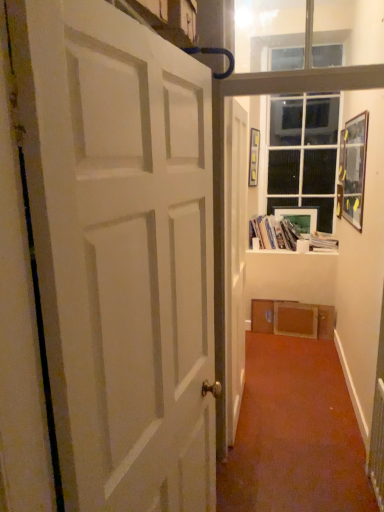
Question: Is the position of white plastic radiator at lower right more distant than that of matte plastic picture frame at upper center, the 2th picture frame positioned from the front?

Choices:
 (A) no
 (B) yes

Answer: (A)

Question: Is white plastic radiator at lower right positioned beyond the bounds of matte plastic picture frame at upper center, which is the first picture frame from back to front?

Choices:
 (A) yes
 (B) no

Answer: (A)

Question: Is white plastic radiator at lower right oriented towards matte plastic picture frame at upper center, which is the first picture frame from back to front?

Choices:
 (A) yes
 (B) no

Answer: (B)

Question: From the image's perspective, would you say white plastic radiator at lower right is shown under matte plastic picture frame at upper center, the 2th picture frame positioned from the front?

Choices:
 (A) no
 (B) yes

Answer: (B)

Question: Is there a large distance between white plastic radiator at lower right and matte plastic picture frame at upper center, the 2th picture frame positioned from the front?

Choices:
 (A) no
 (B) yes

Answer: (B)

Question: In terms of size, does wooden picture frame at upper right, marked as the second picture frame in a back-to-front arrangement, appear bigger or smaller than white matte door at center, the 1th door from the right?

Choices:
 (A) big
 (B) small

Answer: (B)

Question: From a real-world perspective, is wooden picture frame at upper right, marked as the second picture frame in a back-to-front arrangement, physically located above or below white matte door at center, the 1th door from the right?

Choices:
 (A) below
 (B) above

Answer: (B)

Question: Would you say wooden picture frame at upper right, placed as the 1th picture frame when sorted from front to back, is to the left or to the right of white matte door at center, positioned as the 2th door in left-to-right order, in the picture?

Choices:
 (A) left
 (B) right

Answer: (B)

Question: Is wooden picture frame at upper right, placed as the 1th picture frame when sorted from front to back, spatially inside white matte door at center, positioned as the 2th door in left-to-right order, or outside of it?

Choices:
 (A) inside
 (B) outside

Answer: (B)

Question: Is wooden picture frame at upper right, placed as the 1th picture frame when sorted from front to back, inside or outside of white plastic radiator at lower right?

Choices:
 (A) inside
 (B) outside

Answer: (B)

Question: From a real-world perspective, is wooden picture frame at upper right, placed as the 1th picture frame when sorted from front to back, positioned above or below white plastic radiator at lower right?

Choices:
 (A) above
 (B) below

Answer: (A)

Question: Considering the positions of wooden picture frame at upper right, marked as the second picture frame in a back-to-front arrangement, and white plastic radiator at lower right in the image, is wooden picture frame at upper right, marked as the second picture frame in a back-to-front arrangement, bigger or smaller than white plastic radiator at lower right?

Choices:
 (A) big
 (B) small

Answer: (A)

Question: Does point (352, 135) appear closer or farther from the camera than point (370, 424)?

Choices:
 (A) farther
 (B) closer

Answer: (A)

Question: Is white plastic radiator at lower right to the left or to the right of matte plastic picture frame at upper center, which is the first picture frame from back to front, in the image?

Choices:
 (A) left
 (B) right

Answer: (A)

Question: From their relative heights in the image, would you say white plastic radiator at lower right is taller or shorter than matte plastic picture frame at upper center, which is the first picture frame from back to front?

Choices:
 (A) short
 (B) tall

Answer: (B)